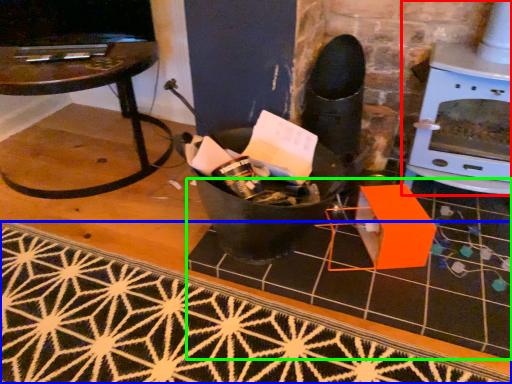
Question: Considering the real-world distances, which object is farthest from fireplace (highlighted by a red box)? doormat (highlighted by a blue box) or tile (highlighted by a green box)?

Choices:
 (A) doormat
 (B) tile

Answer: (A)